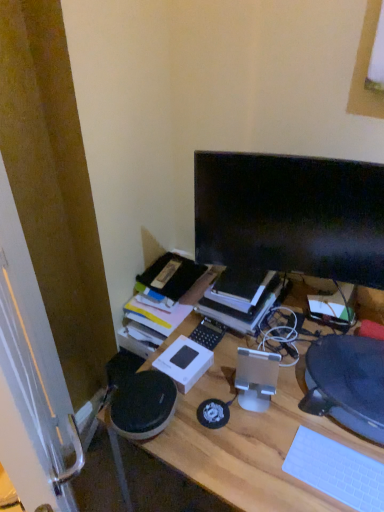
Find the location of a particular element. This screenshot has width=384, height=512. free location above wooden desk at center (from a real-world perspective) is located at coordinates (291, 407).